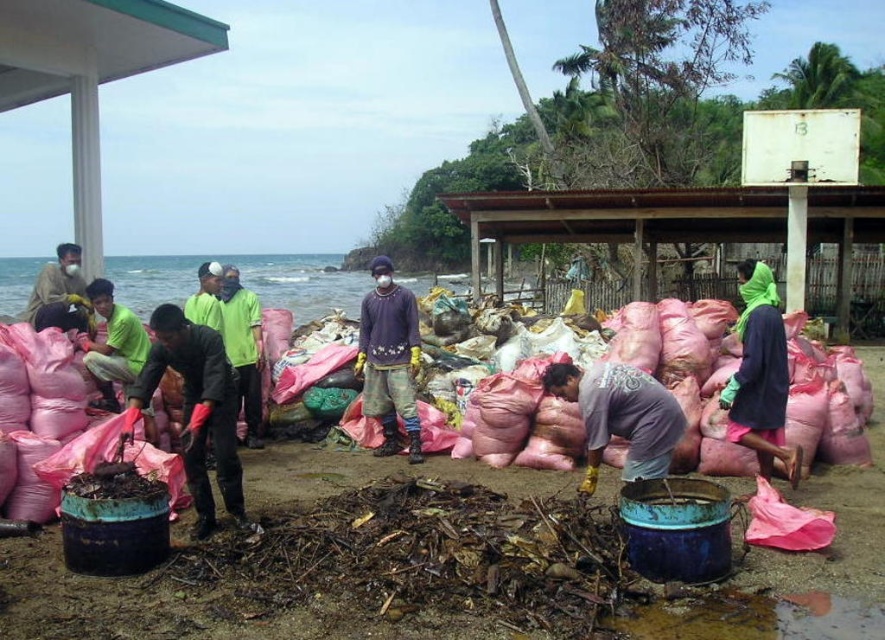
Question: Which point is farther to the camera?

Choices:
 (A) (45, 291)
 (B) (290, 506)
 (C) (233, 380)
 (D) (198, 300)

Answer: (D)

Question: Observing the image, what is the correct spatial positioning of matte black shirt at center in reference to purple matte shirt at center?

Choices:
 (A) right
 (B) left

Answer: (B)

Question: Among these points, which one is nearest to the camera?

Choices:
 (A) (218, 360)
 (B) (77, 250)

Answer: (A)

Question: From the image, what is the correct spatial relationship of matte black shirt at center in relation to gray matte shirt at center?

Choices:
 (A) left
 (B) right

Answer: (A)

Question: Does matte black shirt at center have a smaller size compared to purple matte shirt at center?

Choices:
 (A) no
 (B) yes

Answer: (B)

Question: Which point appears closest to the camera in this image?

Choices:
 (A) (606, 372)
 (B) (209, 320)
 (C) (81, 294)

Answer: (A)